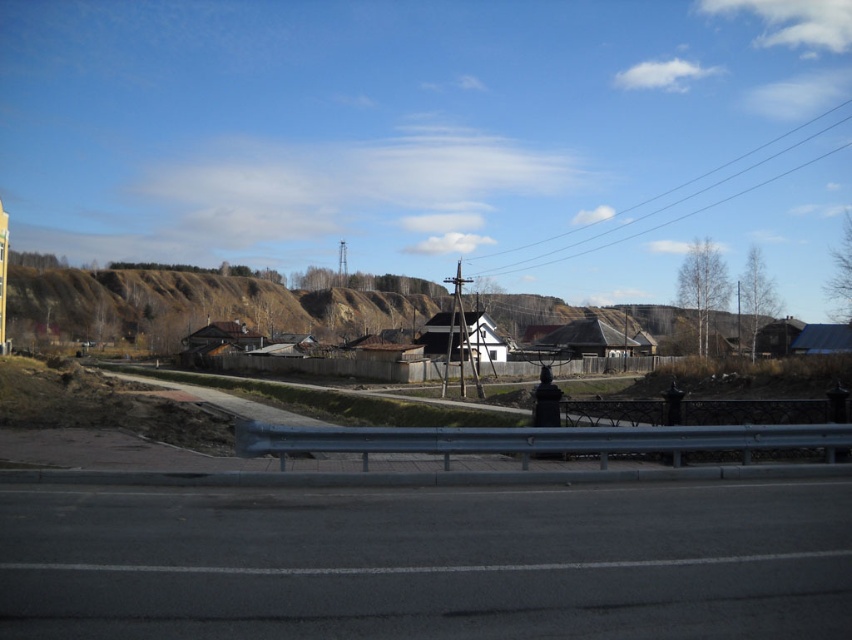
Question: Does black asphalt highway at lower center have a larger size compared to black wire at upper center?

Choices:
 (A) no
 (B) yes

Answer: (A)

Question: Which point is farther from the camera taking this photo?

Choices:
 (A) 565,248
 (B) 320,493

Answer: (A)

Question: Is black asphalt highway at lower center above black wire at upper center?

Choices:
 (A) yes
 (B) no

Answer: (B)

Question: Which of the following is the closest to the observer?

Choices:
 (A) black asphalt highway at lower center
 (B) black wire at upper center

Answer: (A)

Question: Where is black asphalt highway at lower center located in relation to black wire at upper center in the image?

Choices:
 (A) below
 (B) above

Answer: (A)